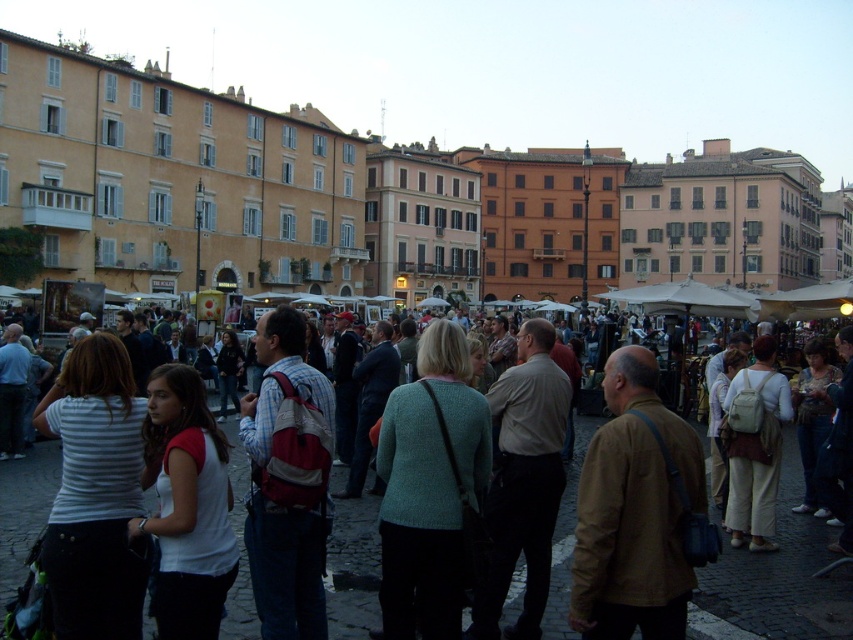
Based on the photo, you are standing in the European square and want to take a photo of the beige stone buildings at upper left. To ensure they are centered in your camera frame, where should you position your camera? Use the coordinate system where the bottom left corner is the origin point, and the top right corner is the maximum point.

The beige stone buildings at upper left are located at coordinate point (268, 195). To center them in your camera frame, position the camera so that the center of the frame aligns with this coordinate.

Based on the photo, you are a tourist standing in the square and want to take a photo of the beige stone buildings at upper left and the matte white shirt at center. Which object should you zoom in more on to capture both in the frame?

You should zoom in more on the beige stone buildings at upper left because it is larger than the matte white shirt at center, allowing both to fit in the frame when focusing on the larger object.

You are standing in the European square and want to take a photo. You notice two points marked in the scene. The first point is at coordinates point (235, 164) and the second is at point (230, 618). Which point is closer to your camera?

Point (235, 164) is further to the camera than point (230, 618), so the second point is closer to the camera.